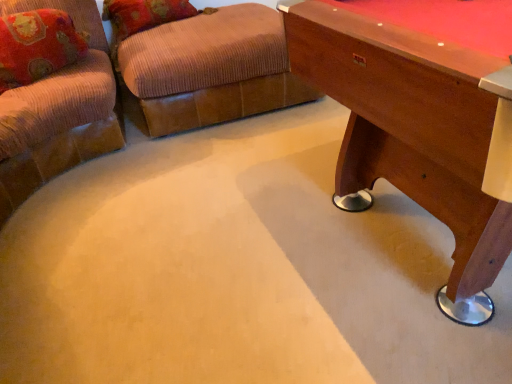
Question: Considering the positions of wooden pool table at right and brown corduroy ottoman at upper center in the image, is wooden pool table at right bigger or smaller than brown corduroy ottoman at upper center?

Choices:
 (A) small
 (B) big

Answer: (B)

Question: Considering the positions of point (394, 97) and point (202, 114), is point (394, 97) closer or farther from the camera than point (202, 114)?

Choices:
 (A) farther
 (B) closer

Answer: (B)

Question: Estimate the real-world distances between objects in this image. Which object is closer to the velvet floral pillow at upper left?

Choices:
 (A) wooden pool table at right
 (B) brown corduroy ottoman at upper center

Answer: (B)

Question: Which object is the farthest from the wooden pool table at right?

Choices:
 (A) brown corduroy ottoman at upper center
 (B) velvet floral pillow at upper left

Answer: (B)